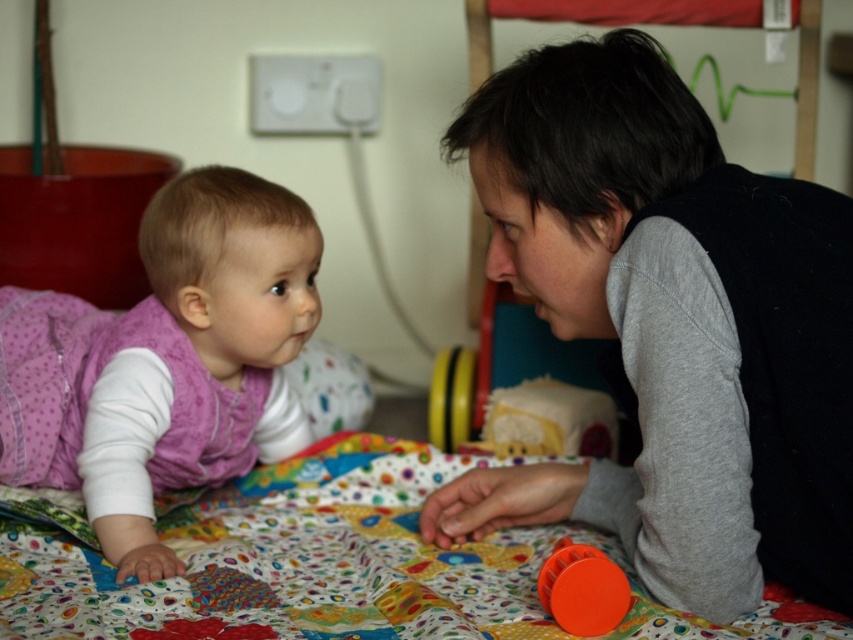
Question: Does pink fabric toddler at lower left lie behind gray cotton shirt at lower right?

Choices:
 (A) yes
 (B) no

Answer: (A)

Question: Which of the following is the farthest from the observer?

Choices:
 (A) gray cotton shirt at upper right
 (B) polka dot fabric quilt at center
 (C) pink fabric toddler at lower left

Answer: (C)

Question: Is gray cotton shirt at lower right above orange matte toy at lower center?

Choices:
 (A) no
 (B) yes

Answer: (B)

Question: Which point is farther to the camera?

Choices:
 (A) (132, 513)
 (B) (560, 618)
 (C) (102, 560)

Answer: (A)

Question: Does gray cotton shirt at upper right appear under pink fabric toddler at lower left?

Choices:
 (A) yes
 (B) no

Answer: (A)

Question: Which object is the farthest from the pink fabric toddler at lower left?

Choices:
 (A) gray cotton shirt at upper right
 (B) orange matte toy at lower center
 (C) polka dot fabric quilt at center
 (D) gray cotton shirt at lower right

Answer: (B)